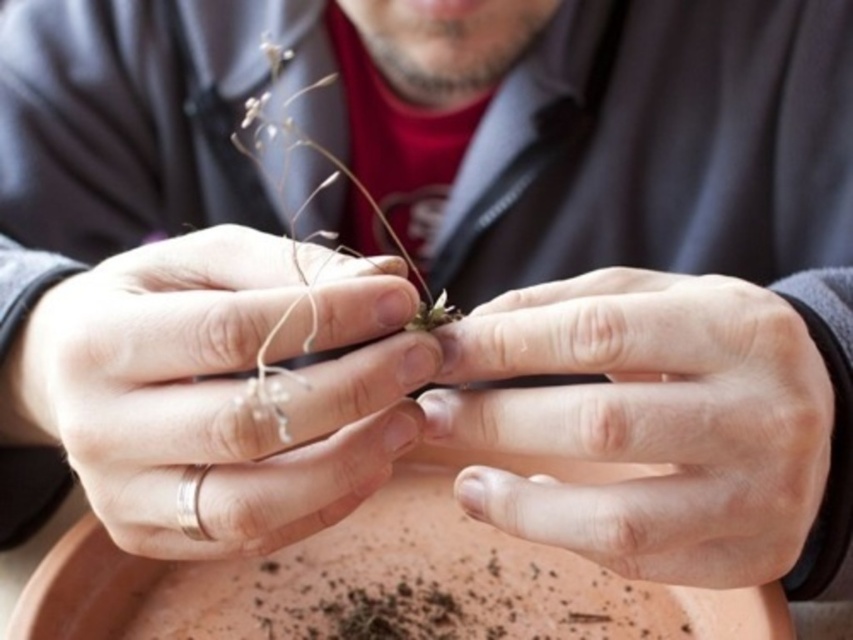
Question: Which of the following is the closest to the observer?

Choices:
 (A) smooth skin hand at center
 (B) silver metallic ring at center

Answer: (A)

Question: Is silver metallic ring at center bigger than smooth skin hand at center?

Choices:
 (A) no
 (B) yes

Answer: (B)

Question: Among these objects, which one is nearest to the camera?

Choices:
 (A) silver metallic ring at center
 (B) smooth skin hand at center

Answer: (B)

Question: Is silver metallic ring at center above smooth skin hand at center?

Choices:
 (A) no
 (B) yes

Answer: (B)

Question: From the image, what is the correct spatial relationship of silver metallic ring at center in relation to smooth skin hand at center?

Choices:
 (A) right
 (B) left

Answer: (B)